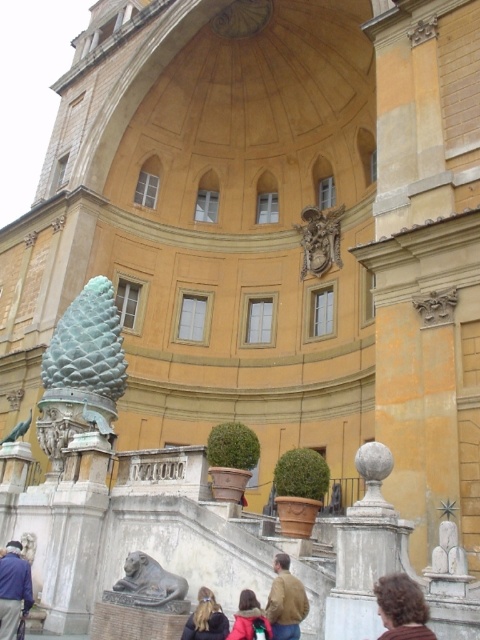
Which of these two, bronze statue at lower center or brown curly hair at lower right, stands taller?

bronze statue at lower center is taller.

Is bronze statue at lower center shorter than brown curly hair at lower right?

No, bronze statue at lower center is not shorter than brown curly hair at lower right.

The width and height of the screenshot is (480, 640). What do you see at coordinates (146, 584) in the screenshot? I see `bronze statue at lower center` at bounding box center [146, 584].

You are a GUI agent. You are given a task and a screenshot of the screen. Output one action in this format:
    pyautogui.click(x=<x>, y=<y>)
    Task: Click on the bronze statue at lower center
    
    Given the screenshot: What is the action you would take?
    pyautogui.click(x=146, y=584)

Between point (284, 577) and point (12, 428), which one is positioned in front?

Point (284, 577) is more forward.

Can you confirm if brown leather jacket at center is smaller than green stone pineapple at center?

Yes, brown leather jacket at center is smaller than green stone pineapple at center.

You are a GUI agent. You are given a task and a screenshot of the screen. Output one action in this format:
    pyautogui.click(x=<x>, y=<y>)
    Task: Click on the brown leather jacket at center
    
    Given the screenshot: What is the action you would take?
    pyautogui.click(x=286, y=600)

Find the location of `brown leather jacket at center`. brown leather jacket at center is located at coordinates point(286,600).

This screenshot has height=640, width=480. What do you see at coordinates (320, 240) in the screenshot? I see `polished stone relief at center` at bounding box center [320, 240].

Does polished stone relief at center appear on the left side of blonde hair at lower center?

In fact, polished stone relief at center is to the right of blonde hair at lower center.

Find the location of a particular element. This screenshot has width=480, height=640. polished stone relief at center is located at coordinates (320, 240).

You are a GUI agent. You are given a task and a screenshot of the screen. Output one action in this format:
    pyautogui.click(x=<x>, y=<y>)
    Task: Click on the polished stone relief at center
    Image resolution: width=480 pixels, height=640 pixels.
    Given the screenshot: What is the action you would take?
    pyautogui.click(x=320, y=240)